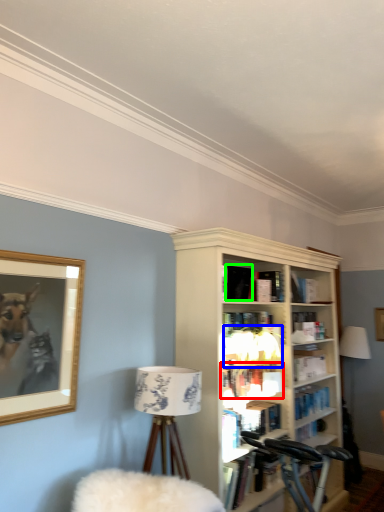
Question: Estimate the real-world distances between objects in this image. Which object is closer to book (highlighted by a red box), lamp (highlighted by a blue box) or book (highlighted by a green box)?

Choices:
 (A) lamp
 (B) book

Answer: (A)